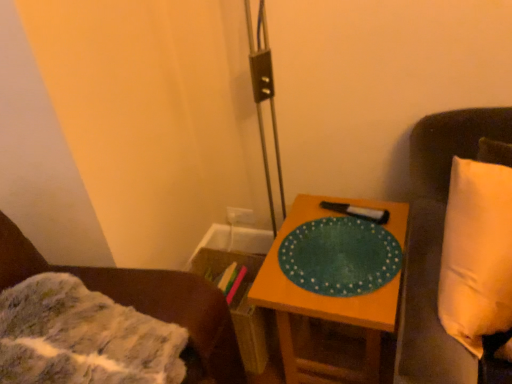
Question: From a real-world perspective, is fuzzy fabric blanket at lower left, which appears as the 1th furniture when viewed from the left, positioned above or below white fabric pillow at right, which is the 1th furniture in right-to-left order?

Choices:
 (A) above
 (B) below

Answer: (A)

Question: Is fuzzy fabric blanket at lower left, which appears as the 1th furniture when viewed from the left, bigger or smaller than white fabric pillow at right, which is the 1th furniture in right-to-left order?

Choices:
 (A) big
 (B) small

Answer: (B)

Question: Which is farther from the fuzzy fabric blanket at lower left, which appears as the 2th furniture when viewed from the right?

Choices:
 (A) green matte placemat at center
 (B) green matte platter at center-right
 (C) white fabric pillow at right, which is the 1th furniture in right-to-left order

Answer: (C)

Question: Estimate the real-world distances between objects in this image. Which object is closer to the green matte placemat at center?

Choices:
 (A) fuzzy fabric blanket at lower left, which appears as the 2th furniture when viewed from the right
 (B) green matte platter at center-right
 (C) white fabric pillow at right, which ranks as the second furniture in left-to-right order

Answer: (B)